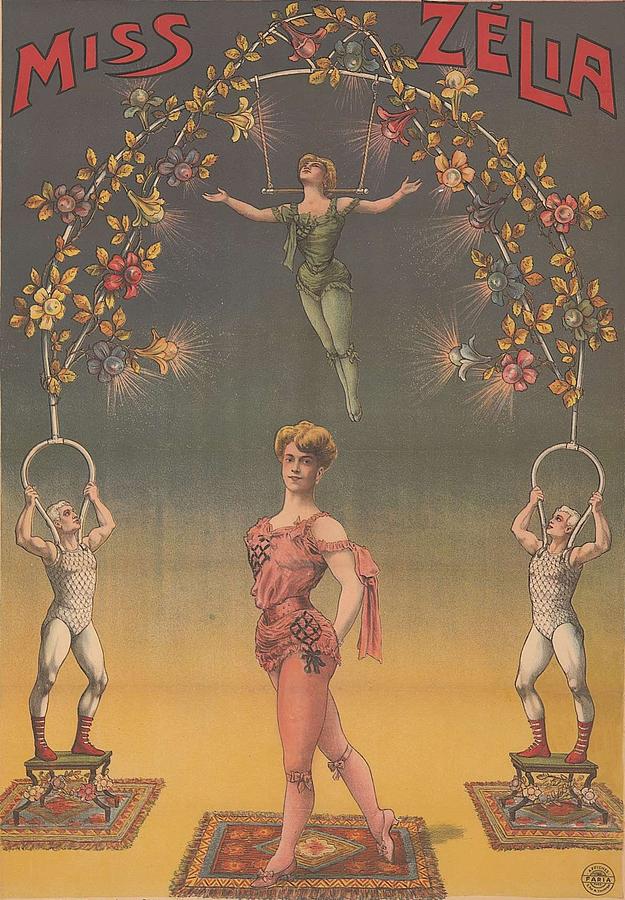
Locate an element on the screen. small rug is located at coordinates (342, 857), (561, 824), (116, 824).